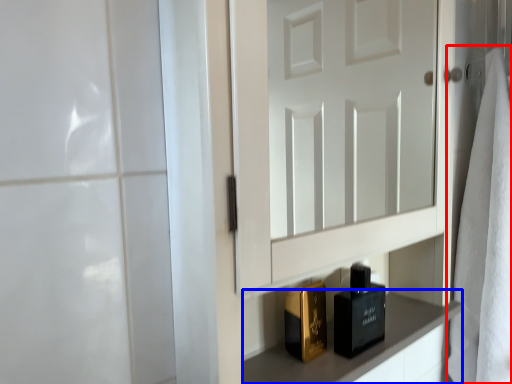
Question: Among these objects, which one is nearest to the camera, bath towel (highlighted by a red box) or cabinetry (highlighted by a blue box)?

Choices:
 (A) bath towel
 (B) cabinetry

Answer: (B)